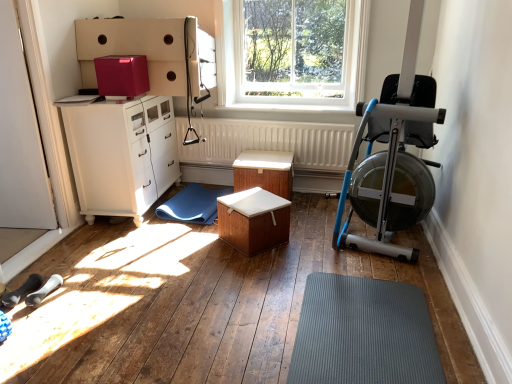
Find the location of a particular element. The height and width of the screenshot is (384, 512). unoccupied area in front of wooden box at center, acting as the 1th table starting from the front is located at coordinates pyautogui.click(x=258, y=271).